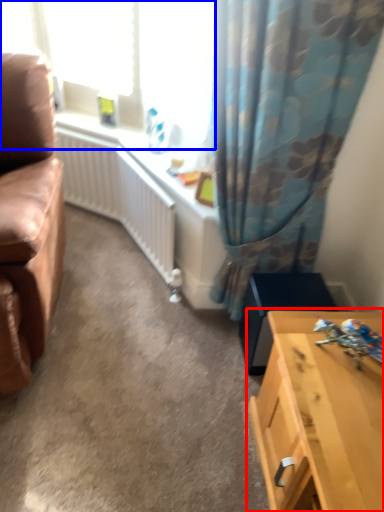
Question: Among these objects, which one is farthest to the camera, table (highlighted by a red box) or window screen (highlighted by a blue box)?

Choices:
 (A) table
 (B) window screen

Answer: (B)